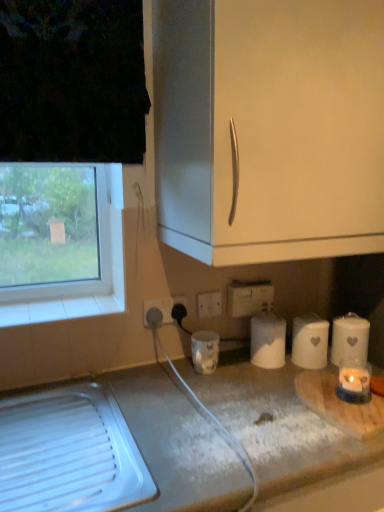
The width and height of the screenshot is (384, 512). I want to click on vacant area that lies in front of white matte paper towel at center, the third paper towel when ordered from right to left, so click(261, 386).